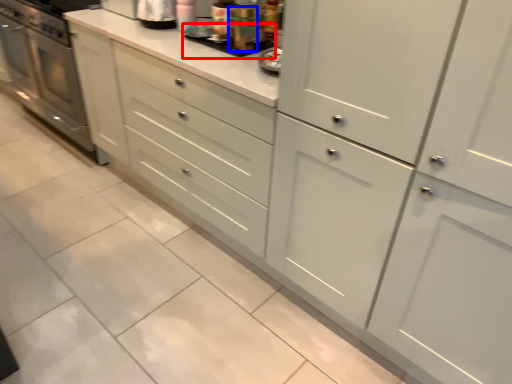
Question: Among these objects, which one is nearest to the camera, appliance (highlighted by a red box) or appliance (highlighted by a blue box)?

Choices:
 (A) appliance
 (B) appliance

Answer: (B)